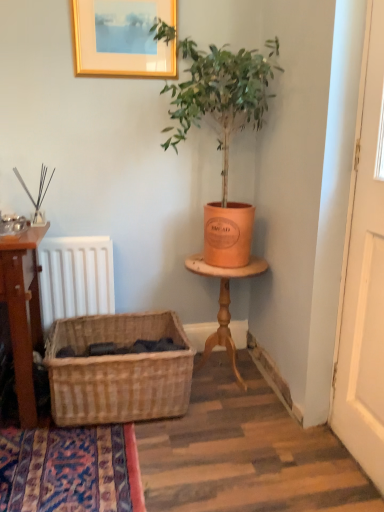
Identify the location of free space in front of white wooden door at right. (362, 490).